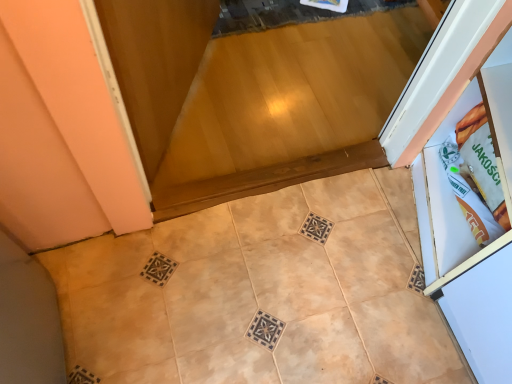
Locate an element on the screen. unoccupied space behind beige matte tile at center, placed as the first ceramic tile when sorted from left to right is located at coordinates (231, 253).